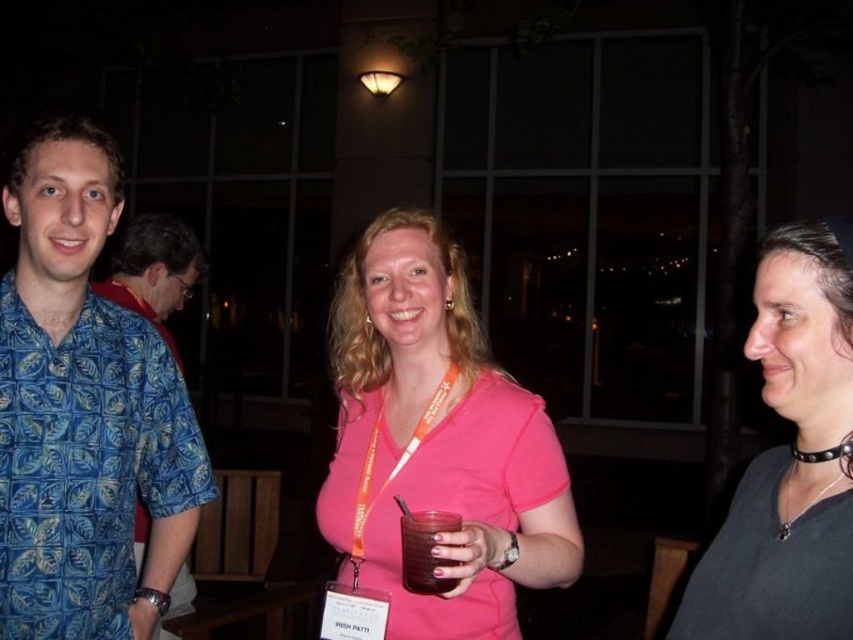
Question: Does blue printed shirt at left have a smaller size compared to pink matte shirt at center?

Choices:
 (A) no
 (B) yes

Answer: (B)

Question: Considering the relative positions of pink matte shirt at center and black leather choker at right in the image provided, where is pink matte shirt at center located with respect to black leather choker at right?

Choices:
 (A) below
 (B) above

Answer: (A)

Question: Among these points, which one is farthest from the camera?

Choices:
 (A) (434, 586)
 (B) (132, 236)
 (C) (747, 492)
 (D) (38, 467)

Answer: (B)

Question: Which object appears closest to the camera in this image?

Choices:
 (A) black leather choker at right
 (B) blue printed shirt at left
 (C) translucent plastic cup at center

Answer: (A)

Question: Based on their relative distances, which object is nearer to the black leather choker at right?

Choices:
 (A) blue patterned shirt at left
 (B) blue printed shirt at left
 (C) translucent plastic cup at center

Answer: (C)

Question: Is blue printed shirt at left wider than pink matte shirt at center?

Choices:
 (A) no
 (B) yes

Answer: (A)